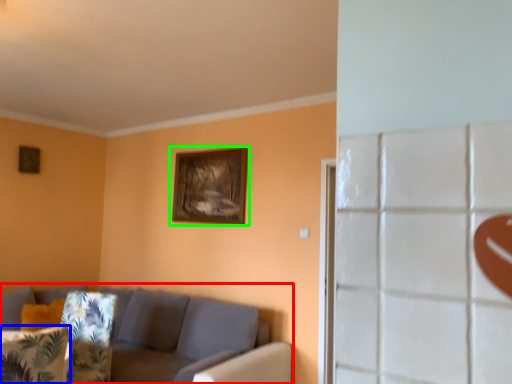
Question: Estimate the real-world distances between objects in this image. Which object is closer to studio couch (highlighted by a red box), pillow (highlighted by a blue box) or picture frame (highlighted by a green box)?

Choices:
 (A) pillow
 (B) picture frame

Answer: (B)